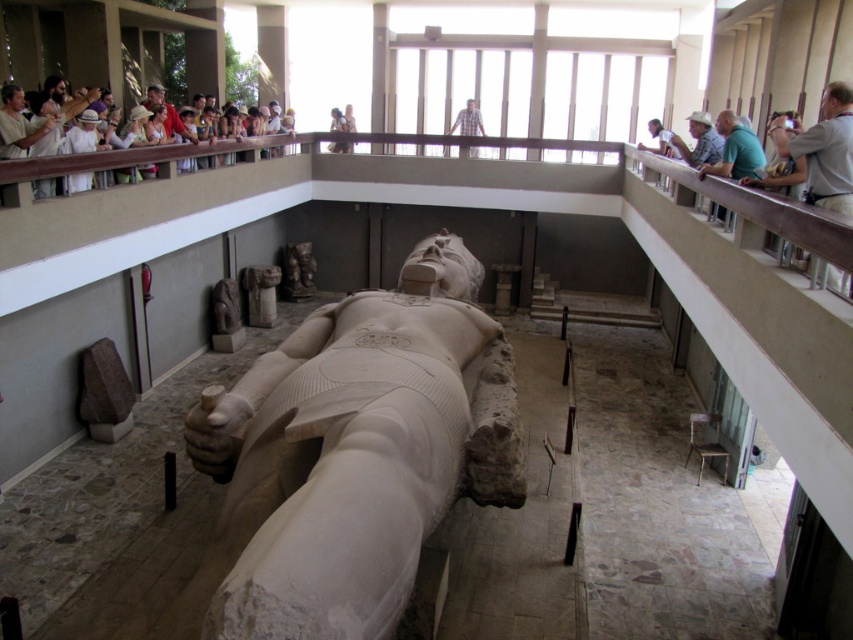
Which is above, white cotton hat at upper left or smooth stone column at center?

Positioned higher is white cotton hat at upper left.

Which is in front, point (88, 179) or point (270, 291)?

Point (88, 179) is in front.

Who is more forward, (219,154) or (254,317)?

Point (219,154)

This screenshot has width=853, height=640. What are the coordinates of `white cotton hat at upper left` in the screenshot? It's located at (105, 154).

Is smooth stone column at center above white stone statue at upper center?

No, smooth stone column at center is not above white stone statue at upper center.

Is point (263, 324) closer to camera compared to point (674, 148)?

No, (263, 324) is further to viewer.

Is point (264, 305) positioned in front of point (676, 145)?

No.

At what (x,y) coordinates should I click in order to perform the action: click on smooth stone column at center. Please return your answer as a coordinate pair (x, y). Looking at the image, I should click on [x=260, y=292].

Does smooth stone column at center appear on the right side of plaid shirt at upper center?

In fact, smooth stone column at center is to the left of plaid shirt at upper center.

Is smooth stone column at center below plaid shirt at upper center?

Yes, smooth stone column at center is below plaid shirt at upper center.

This screenshot has height=640, width=853. What do you see at coordinates (260, 292) in the screenshot? I see `smooth stone column at center` at bounding box center [260, 292].

Locate an element on the screen. This screenshot has height=640, width=853. smooth stone column at center is located at coordinates (260, 292).